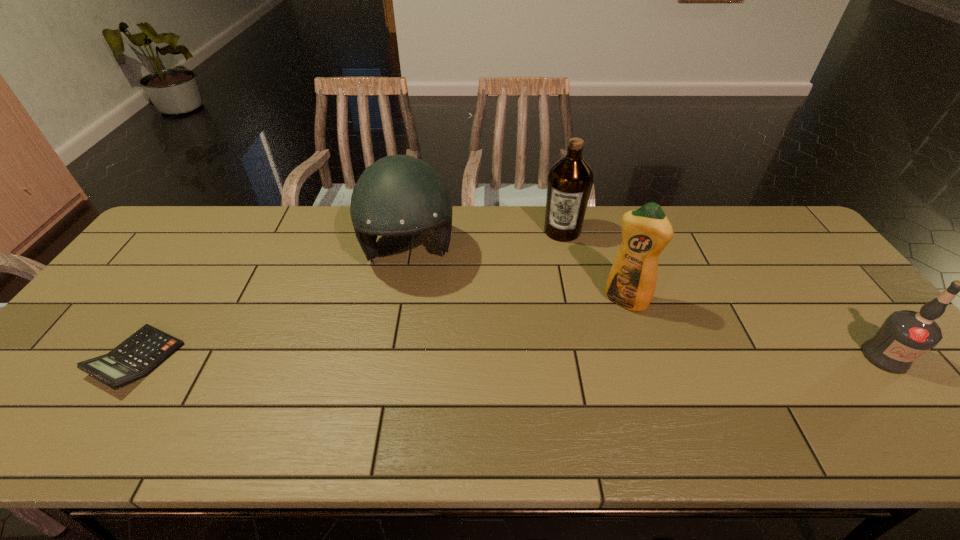
The height and width of the screenshot is (540, 960). I want to click on free space on the desktop that is between the calculator and the vodka and is positioned on the label of the detergent, so click(589, 357).

You are a GUI agent. You are given a task and a screenshot of the screen. Output one action in this format:
    pyautogui.click(x=<x>, y=<y>)
    Task: Click on the free space on the desktop that is between the calculator and the rightmost object and is positioned on the label of the olive oil
    
    Given the screenshot: What is the action you would take?
    pyautogui.click(x=523, y=358)

Identify the location of free space on the desktop that is between the shortest object and the vodka and is positioned at the face opening of the football helmet. (418, 358).